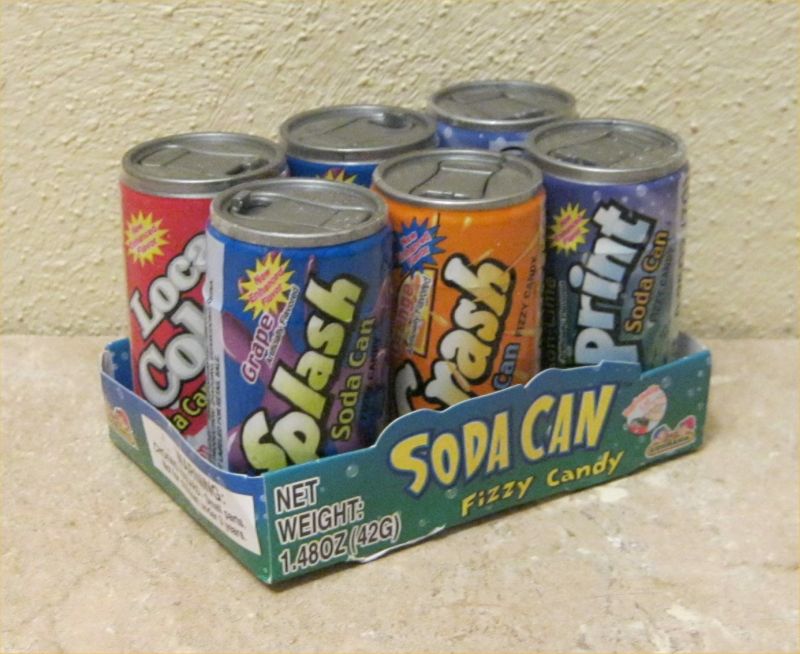
Where is `marbled countertop`? marbled countertop is located at coordinates (89, 559).